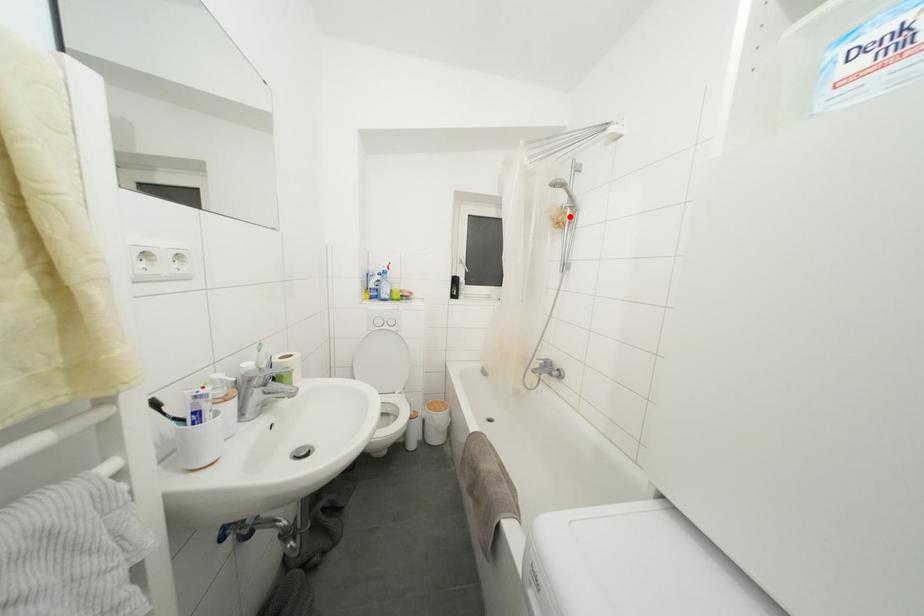
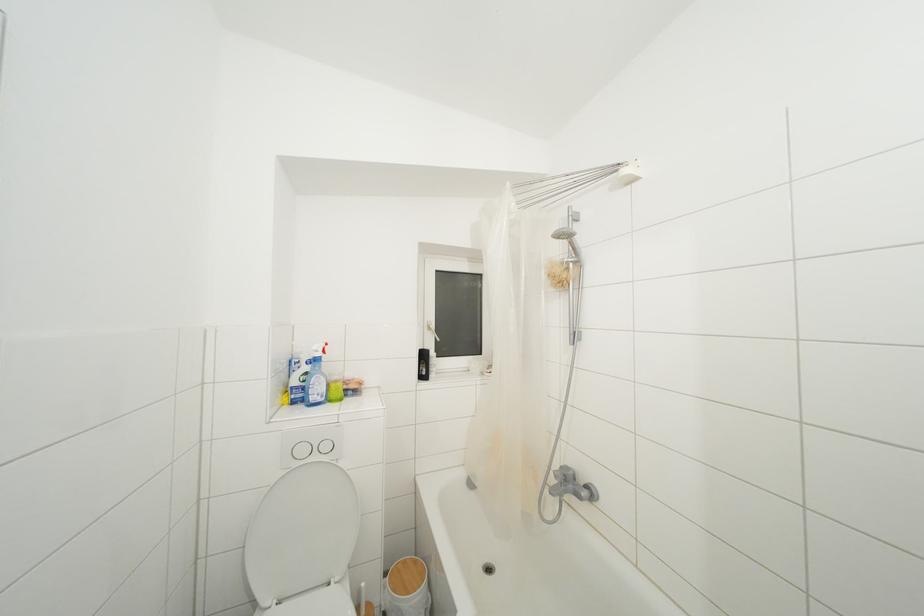
Locate, in the second image, the point that corresponds to the highlighted location in the first image.

(572, 273)